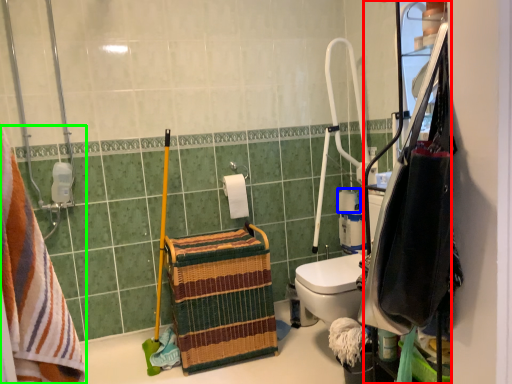
Question: Which is nearer to the cabinetry (highlighted by a red box)? toilet paper (highlighted by a blue box) or towel (highlighted by a green box).

Choices:
 (A) toilet paper
 (B) towel

Answer: (B)